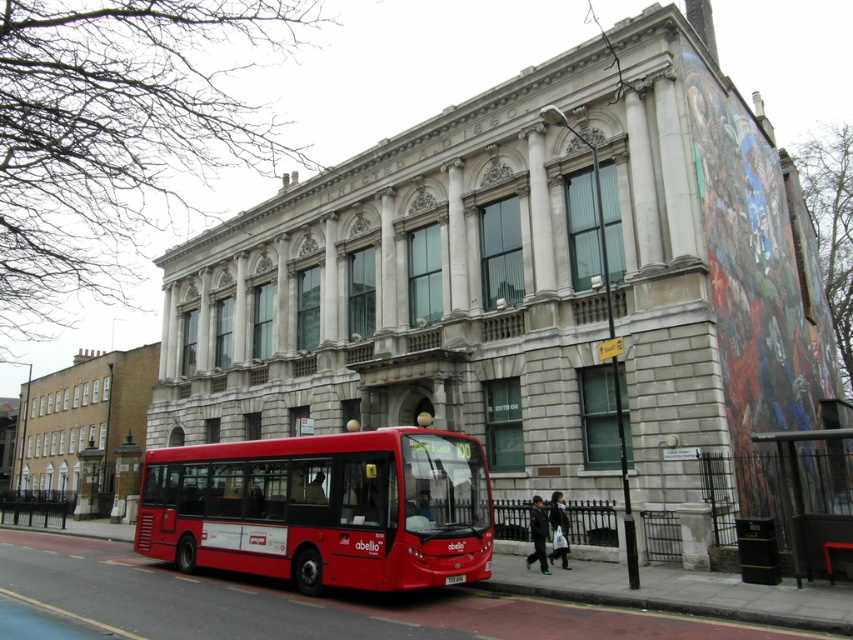
Question: Does shiny red bus at center appear on the left side of metallic black bus stop at lower right?

Choices:
 (A) yes
 (B) no

Answer: (A)

Question: Does shiny red bus at center have a greater width compared to metallic black bus stop at lower right?

Choices:
 (A) no
 (B) yes

Answer: (B)

Question: Which object is closer to the camera taking this photo?

Choices:
 (A) shiny red bus at center
 (B) metallic black bus stop at lower right

Answer: (A)

Question: Which object is closer to the camera taking this photo?

Choices:
 (A) metallic black bus stop at lower right
 (B) shiny red bus at center

Answer: (B)

Question: Can you confirm if shiny red bus at center is positioned above metallic black bus stop at lower right?

Choices:
 (A) no
 (B) yes

Answer: (A)